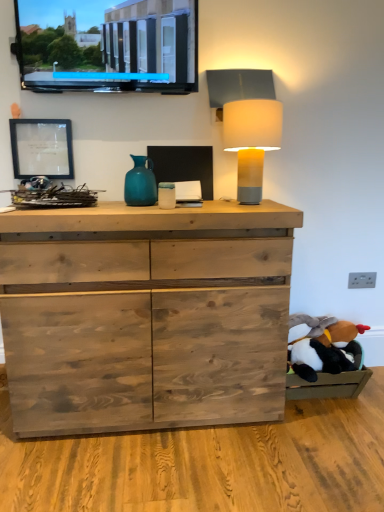
Find the location of a particular element. This screenshot has height=512, width=384. natural wood chest of drawers at center is located at coordinates (145, 316).

Measure the distance between point (304,315) and camera.

A distance of 7.26 feet exists between point (304,315) and camera.

The height and width of the screenshot is (512, 384). I want to click on matte glass picture frame at upper left, so click(42, 148).

Image resolution: width=384 pixels, height=512 pixels. Describe the element at coordinates (140, 183) in the screenshot. I see `teal glass vase at center` at that location.

I want to click on matte yellow lampshade at upper right, so click(x=247, y=122).

Which object is more forward, black plush toy at lower right or teal glass vase at center?

teal glass vase at center is in front.

Is black plush toy at lower right in contact with teal glass vase at center?

No, black plush toy at lower right is not making contact with teal glass vase at center.

How distant is black plush toy at lower right from teal glass vase at center?

The distance of black plush toy at lower right from teal glass vase at center is 3.43 feet.

Which object is positioned more to the left, black plush toy at lower right or teal glass vase at center?

Positioned to the left is teal glass vase at center.

Can you tell me how much teal glass vase at center and matte yellow lampshade at upper right differ in facing direction?

1.83 degrees separate the facing orientations of teal glass vase at center and matte yellow lampshade at upper right.

Consider the image. How far apart are teal glass vase at center and matte yellow lampshade at upper right?

teal glass vase at center and matte yellow lampshade at upper right are 44.48 centimeters apart from each other.

From a real-world perspective, is teal glass vase at center under matte yellow lampshade at upper right?

Indeed, from a real-world perspective, teal glass vase at center is positioned beneath matte yellow lampshade at upper right.

Considering the sizes of objects teal glass vase at center and matte yellow lampshade at upper right in the image provided, who is smaller, teal glass vase at center or matte yellow lampshade at upper right?

With smaller size is teal glass vase at center.

Does black plush toy at lower right turn towards matte yellow lampshade at upper right?

No, black plush toy at lower right is not turned towards matte yellow lampshade at upper right.

Would you consider black plush toy at lower right to be distant from matte yellow lampshade at upper right?

black plush toy at lower right is near matte yellow lampshade at upper right, not far away.

From a real-world perspective, between black plush toy at lower right and matte yellow lampshade at upper right, who is vertically lower?

black plush toy at lower right, from a real-world perspective.

Is black plush toy at lower right behind matte yellow lampshade at upper right?

Yes, it is.

Which is more to the left, matte black screen at upper left or natural wood chest of drawers at center?

Positioned to the left is matte black screen at upper left.

Looking at this image, from a real-world perspective, who is located lower, matte black screen at upper left or natural wood chest of drawers at center?

natural wood chest of drawers at center, from a real-world perspective.

Is matte black screen at upper left bigger than natural wood chest of drawers at center?

No.

Consider the image. What's the angular difference between matte black screen at upper left and black plush toy at lower right's facing directions?

They differ by 1.81 degrees in their facing directions.

Considering the relative positions of matte black screen at upper left and black plush toy at lower right in the image provided, is matte black screen at upper left to the left of black plush toy at lower right from the viewer's perspective?

Correct, you'll find matte black screen at upper left to the left of black plush toy at lower right.

Considering the positions of points (43, 41) and (320, 324), is point (43, 41) closer to camera compared to point (320, 324)?

Yes, it is in front of point (320, 324).

Is matte black screen at upper left smaller than black plush toy at lower right?

No.

Can you confirm if teal glass vase at center is bigger than matte glass picture frame at upper left?

Yes.

From the image's perspective, is teal glass vase at center located above or below matte glass picture frame at upper left?

Clearly, from the image's perspective, teal glass vase at center is below matte glass picture frame at upper left.

Is teal glass vase at center positioned with its back to matte glass picture frame at upper left?

That's not correct — teal glass vase at center is not looking away from matte glass picture frame at upper left.

Considering the sizes of objects teal glass vase at center and matte glass picture frame at upper left in the image provided, who is taller, teal glass vase at center or matte glass picture frame at upper left?

matte glass picture frame at upper left is taller.

Does point (258, 110) come closer to viewer compared to point (355, 344)?

Yes, it is.

Is matte yellow lampshade at upper right with black plush toy at lower right?

No, matte yellow lampshade at upper right is not making contact with black plush toy at lower right.

Can you confirm if matte yellow lampshade at upper right is shorter than black plush toy at lower right?

In fact, matte yellow lampshade at upper right may be taller than black plush toy at lower right.

From a real-world perspective, is matte yellow lampshade at upper right on black plush toy at lower right?

Yes, from a real-world perspective, matte yellow lampshade at upper right is over black plush toy at lower right

This screenshot has height=512, width=384. What are the coordinates of `vase above the black plush toy at lower right (from a real-world perspective)` in the screenshot? It's located at (140, 183).

The image size is (384, 512). In the image, there is a matte yellow lampshade at upper right. Identify the location of vase below it (from a real-world perspective). (140, 183).

From the image, which object appears to be nearer to matte black screen at upper left, matte yellow lampshade at upper right or teal glass vase at center?

matte yellow lampshade at upper right is closer to matte black screen at upper left.

From the picture: Looking at the image, which one is located closer to black plush toy at lower right, matte glass picture frame at upper left or matte black screen at upper left?

matte glass picture frame at upper left is positioned closer to the anchor black plush toy at lower right.

When comparing their distances from natural wood chest of drawers at center, does black plush toy at lower right or teal glass vase at center seem closer?

The object closer to natural wood chest of drawers at center is teal glass vase at center.

When comparing their distances from matte black screen at upper left, does teal glass vase at center or natural wood chest of drawers at center seem closer?

teal glass vase at center is positioned closer to the anchor matte black screen at upper left.

Which object lies nearer to the anchor point matte yellow lampshade at upper right, matte glass picture frame at upper left or natural wood chest of drawers at center?

Among the two, natural wood chest of drawers at center is located nearer to matte yellow lampshade at upper right.

Looking at the image, which one is located closer to matte yellow lampshade at upper right, matte black screen at upper left or teal glass vase at center?

matte black screen at upper left is closer to matte yellow lampshade at upper right.

From the image, which object appears to be farther from matte black screen at upper left, teal glass vase at center or matte glass picture frame at upper left?

Based on the image, teal glass vase at center appears to be further to matte black screen at upper left.

Estimate the real-world distances between objects in this image. Which object is closer to matte glass picture frame at upper left, matte yellow lampshade at upper right or teal glass vase at center?

teal glass vase at center is positioned closer to the anchor matte glass picture frame at upper left.

Locate an element on the screen. This screenshot has height=512, width=384. chest of drawers between matte glass picture frame at upper left and matte yellow lampshade at upper right in the horizontal direction is located at coordinates (145, 316).

Where is `the chest of drawers between matte yellow lampshade at upper right and black plush toy at lower right vertically`? The width and height of the screenshot is (384, 512). the chest of drawers between matte yellow lampshade at upper right and black plush toy at lower right vertically is located at coordinates (145, 316).

Identify the location of the chest of drawers between matte black screen at upper left and black plush toy at lower right vertically. (145, 316).

You are a GUI agent. You are given a task and a screenshot of the screen. Output one action in this format:
    pyautogui.click(x=<x>, y=<y>)
    Task: Click on the picture frame that lies between matte black screen at upper left and black plush toy at lower right from top to bottom
    The height and width of the screenshot is (512, 384).
    Given the screenshot: What is the action you would take?
    pyautogui.click(x=42, y=148)